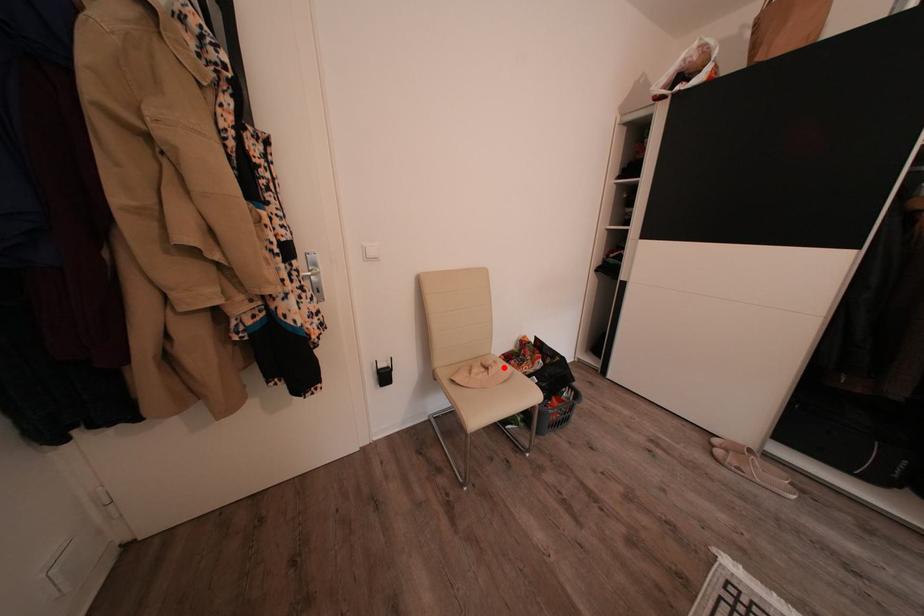
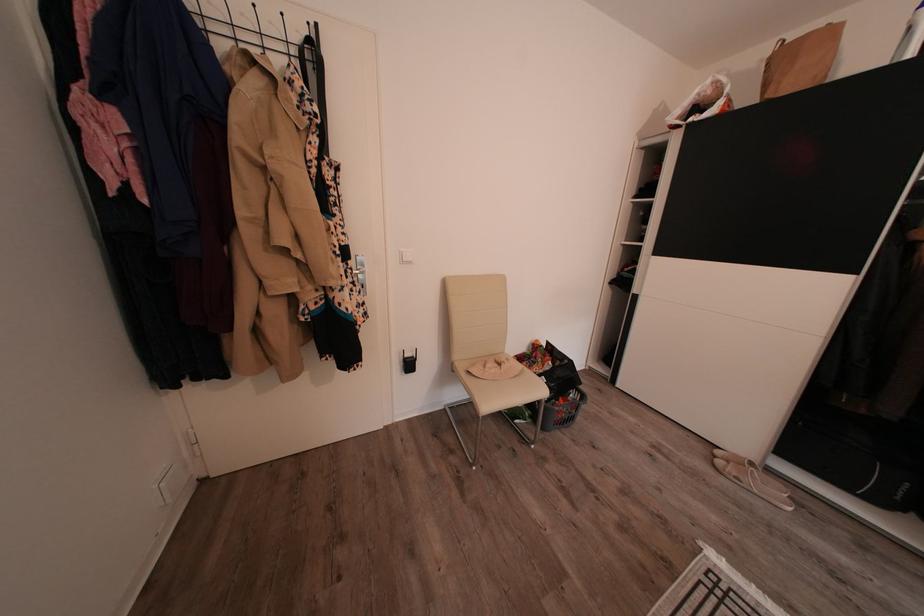
The point at the highlighted location is marked in the first image. Where is the corresponding point in the second image?

(516, 365)